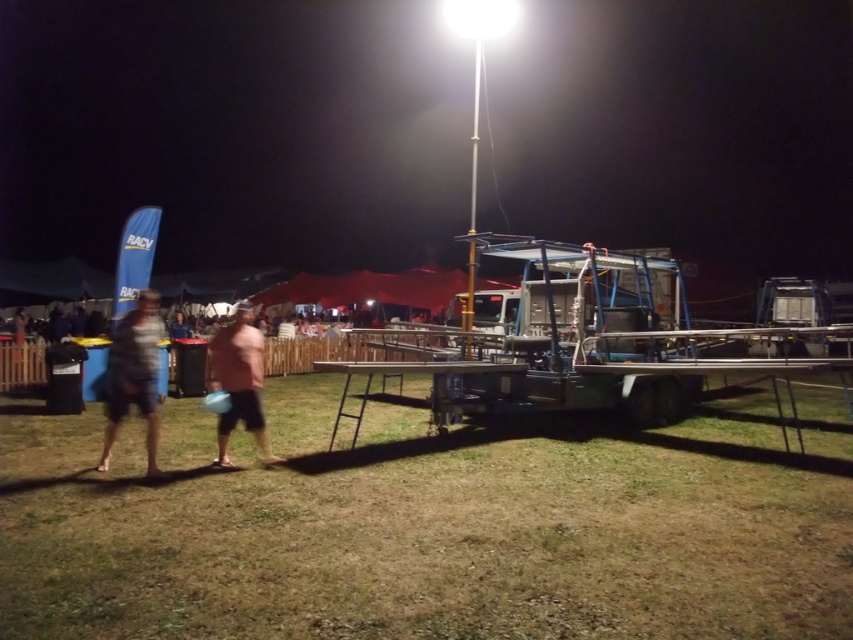
Between metallic trailer at center and gray fabric shorts at lower left, which one appears on the left side from the viewer's perspective?

From the viewer's perspective, gray fabric shorts at lower left appears more on the left side.

Does metallic trailer at center have a lesser width compared to gray fabric shorts at lower left?

No.

Who is more distant from viewer, (91, 241) or (154, 433)?

The point (91, 241) is behind.

The height and width of the screenshot is (640, 853). Find the location of `metallic trailer at center`. metallic trailer at center is located at coordinates (235, 131).

Which is more to the left, gray fabric shorts at lower left or pink matte shirt at center?

pink matte shirt at center is more to the left.

Does gray fabric shorts at lower left appear on the left side of pink matte shirt at center?

Incorrect, gray fabric shorts at lower left is not on the left side of pink matte shirt at center.

Is point (111, 401) more distant than point (241, 358)?

No, it is not.

Where is `gray fabric shorts at lower left`? gray fabric shorts at lower left is located at coordinates (134, 376).

Can you confirm if metallic trailer at center is positioned below green grass at lower center?

No.

Which is in front, point (809, 97) or point (490, 467)?

Point (490, 467) is more forward.

Find the location of `metallic trailer at center`. metallic trailer at center is located at coordinates (235, 131).